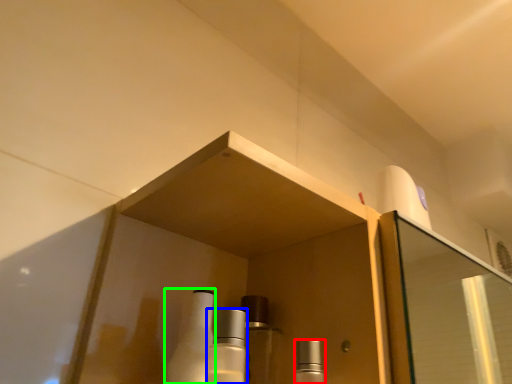
Question: Estimate the real-world distances between objects in this image. Which object is closer to mouthwash (highlighted by a red box), mouthwash (highlighted by a blue box) or bottle (highlighted by a green box)?

Choices:
 (A) mouthwash
 (B) bottle

Answer: (A)